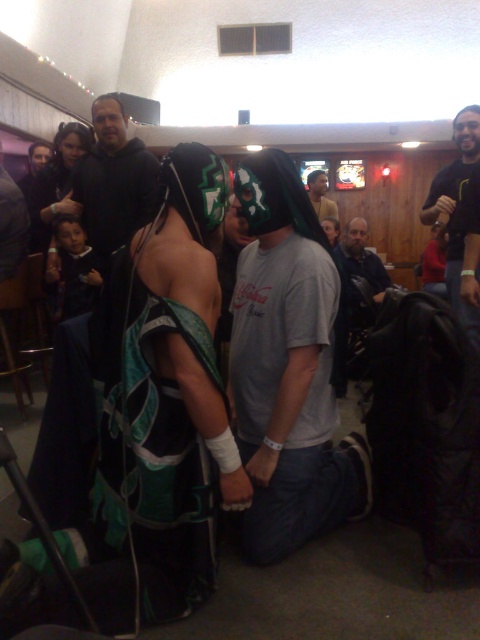
Is gray cotton t-shirt at center further to the viewer compared to gray cotton shirt at center?

That is False.

Does gray cotton t-shirt at center have a greater width compared to gray cotton shirt at center?

Correct, the width of gray cotton t-shirt at center exceeds that of gray cotton shirt at center.

You are a GUI agent. You are given a task and a screenshot of the screen. Output one action in this format:
    pyautogui.click(x=<x>, y=<y>)
    Task: Click on the gray cotton t-shirt at center
    This screenshot has height=640, width=480.
    Given the screenshot: What is the action you would take?
    pyautogui.click(x=361, y=259)

Which is more to the right, dark gray hoodie at upper left or gray cotton shirt at center?

Positioned to the right is gray cotton shirt at center.

Which of these two, dark gray hoodie at upper left or gray cotton shirt at center, stands taller?

dark gray hoodie at upper left is taller.

Identify the location of dark gray hoodie at upper left. (113, 180).

Does white cotton t-shirt at center have a smaller size compared to gray cotton shirt at center?

No.

Does white cotton t-shirt at center lie in front of gray cotton shirt at center?

Yes, white cotton t-shirt at center is closer to the viewer.

This screenshot has height=640, width=480. I want to click on white cotton t-shirt at center, so click(287, 365).

Locate an element on the screen. The image size is (480, 640). white cotton t-shirt at center is located at coordinates pyautogui.click(x=287, y=365).